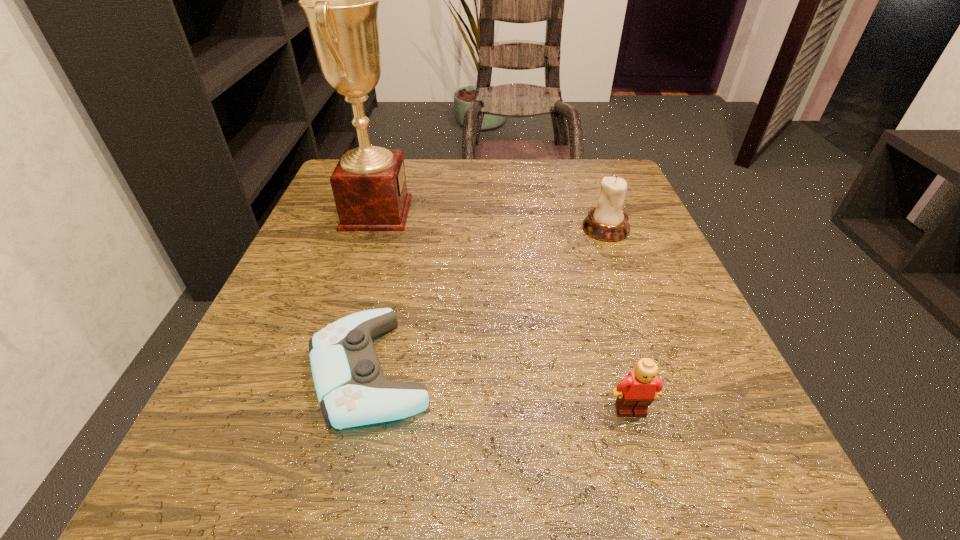
Where is `trophy cup`? This screenshot has width=960, height=540. trophy cup is located at coordinates (340, 0).

At what (x,y) coordinates should I click in order to perform the action: click on candle holder. Please return your answer as a coordinate pair (x, y). The width and height of the screenshot is (960, 540). Looking at the image, I should click on coord(607,222).

Locate an element on the screen. The image size is (960, 540). Lego is located at coordinates (636, 392).

Locate an element on the screen. The height and width of the screenshot is (540, 960). the shortest object is located at coordinates (351, 388).

The image size is (960, 540). Find the location of `blank space located on the plaque of the trophy cup`. blank space located on the plaque of the trophy cup is located at coordinates (451, 213).

Locate an element on the screen. This screenshot has width=960, height=540. vacant area situated 0.070m on the left of the candle holder is located at coordinates (547, 228).

Locate an element on the screen. Image resolution: width=960 pixels, height=540 pixels. free space located 0.050m on the face of the Lego is located at coordinates (644, 456).

This screenshot has height=540, width=960. Identify the location of blank space located 0.370m on the right of the control. (692, 370).

You are a GUI agent. You are given a task and a screenshot of the screen. Output one action in this format:
    pyautogui.click(x=<x>, y=<y>)
    Task: Click on the object located at the far edge
    This screenshot has height=540, width=960.
    Given the screenshot: What is the action you would take?
    pyautogui.click(x=340, y=0)

The width and height of the screenshot is (960, 540). Identify the location of trophy cup situated at the left edge. (340, 0).